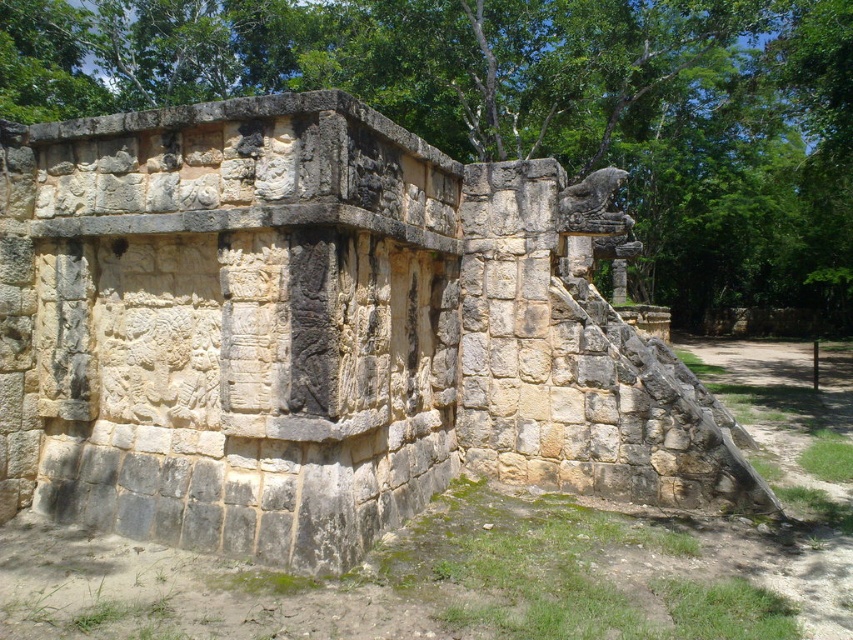
You are an archaeologist examining the ancient stone structure. You notice the natural stone wall at center and the green leafy tree at upper center. Which object has a greater width?

The green leafy tree at upper center has a greater width than the natural stone wall at center.

You are standing in front of the ancient stone structure. There are two points marked on the structure. The first point is at coordinate point (161,480) and the second point is at coordinate point (758,196). Which point is closer to you?

Point (161,480) is closer to you than point (758,196) because the description states that point (161,480) is closer to the camera than point (758,196).